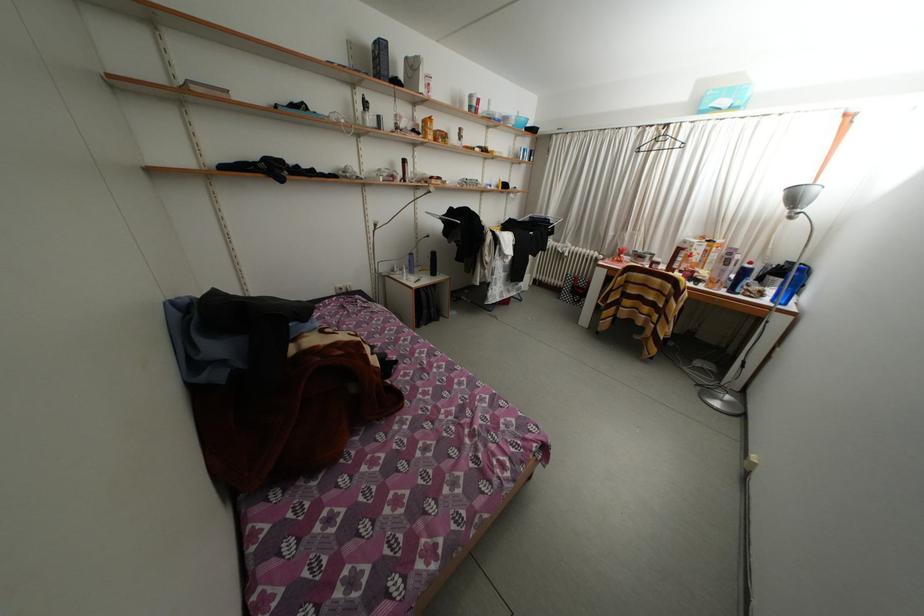
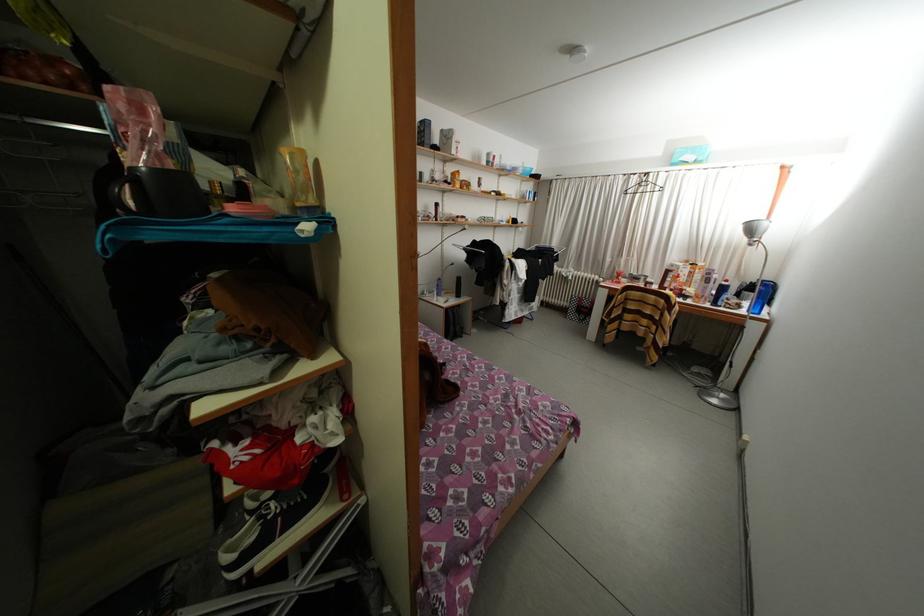
In the second image, find the point that corresponds to point 769,299 in the first image.

(747, 310)